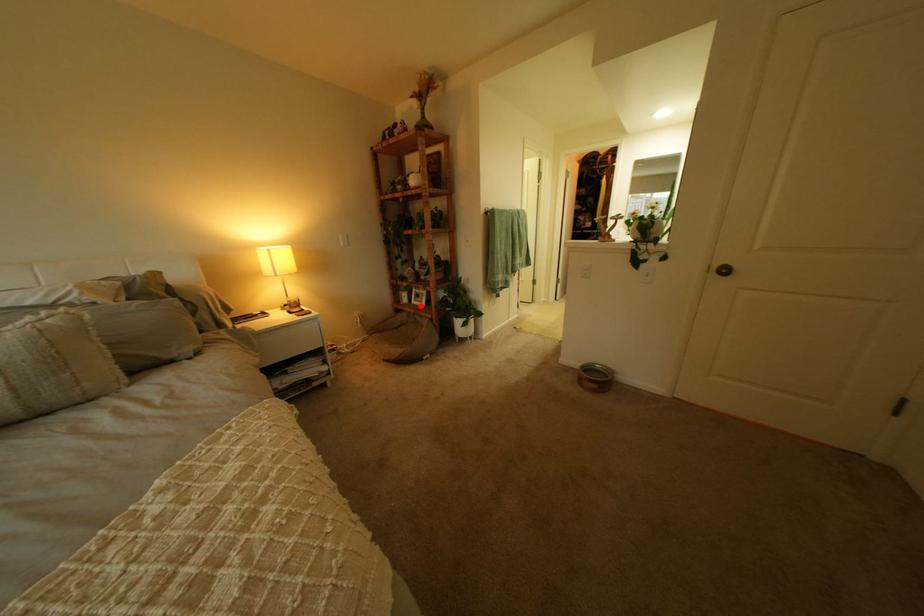
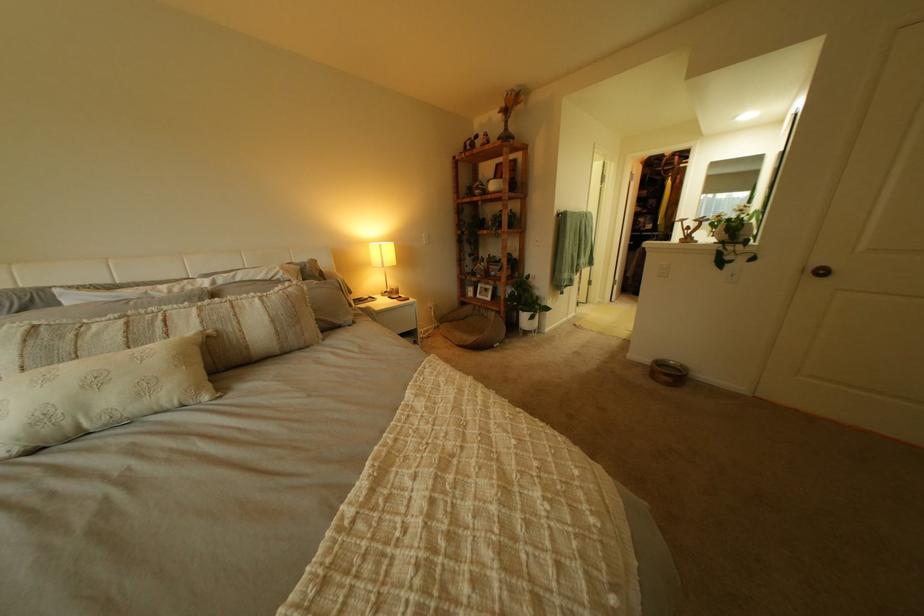
Question: A red point is marked in image1. In image2, is the corresponding 3D point closer to the camera or farther? Reply with the corresponding letter.

Choices:
 (A) The corresponding 3D point is closer.
 (B) The corresponding 3D point is farther.

Answer: (A)